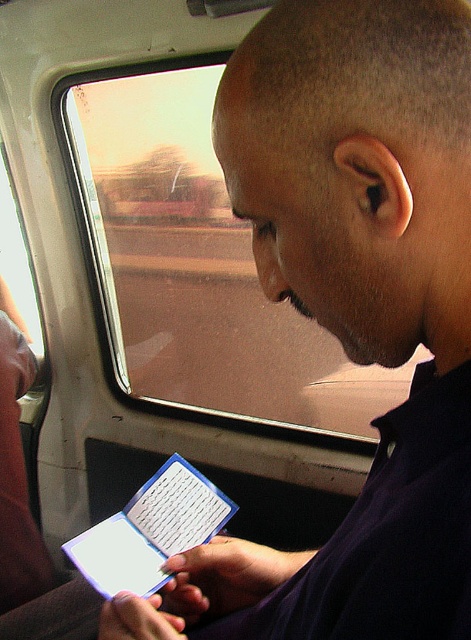
Question: Which point is farther to the camera?

Choices:
 (A) (91, 570)
 (B) (157, 368)

Answer: (B)

Question: Observing the image, what is the correct spatial positioning of transparent glass train window at center in reference to blue plastic tablet at center?

Choices:
 (A) right
 (B) left

Answer: (B)

Question: Which of the following is the closest to the observer?

Choices:
 (A) blue plastic tablet at center
 (B) transparent glass train window at center

Answer: (A)

Question: Considering the relative positions of transparent glass train window at center and blue plastic tablet at center in the image provided, where is transparent glass train window at center located with respect to blue plastic tablet at center?

Choices:
 (A) below
 (B) above

Answer: (B)

Question: Is transparent glass train window at center above blue plastic tablet at center?

Choices:
 (A) yes
 (B) no

Answer: (A)